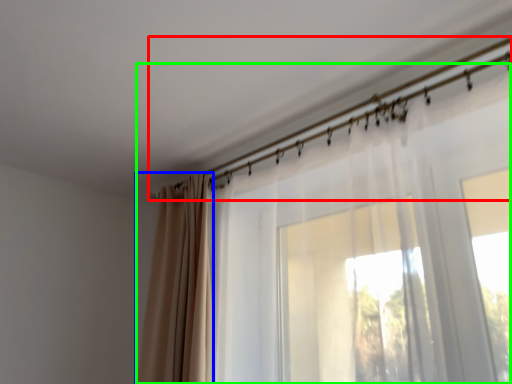
Question: Which is farther away from clothesline (highlighted by a red box)? curtain (highlighted by a blue box) or curtain (highlighted by a green box)?

Choices:
 (A) curtain
 (B) curtain

Answer: (A)